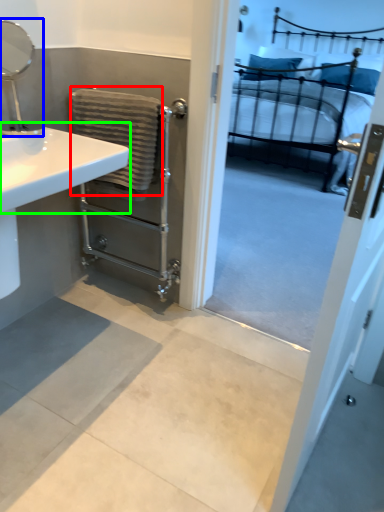
Question: Which object is positioned closest to bath towel (highlighted by a red box)? Select from mirror (highlighted by a blue box) and counter top (highlighted by a green box).

Choices:
 (A) mirror
 (B) counter top

Answer: (B)